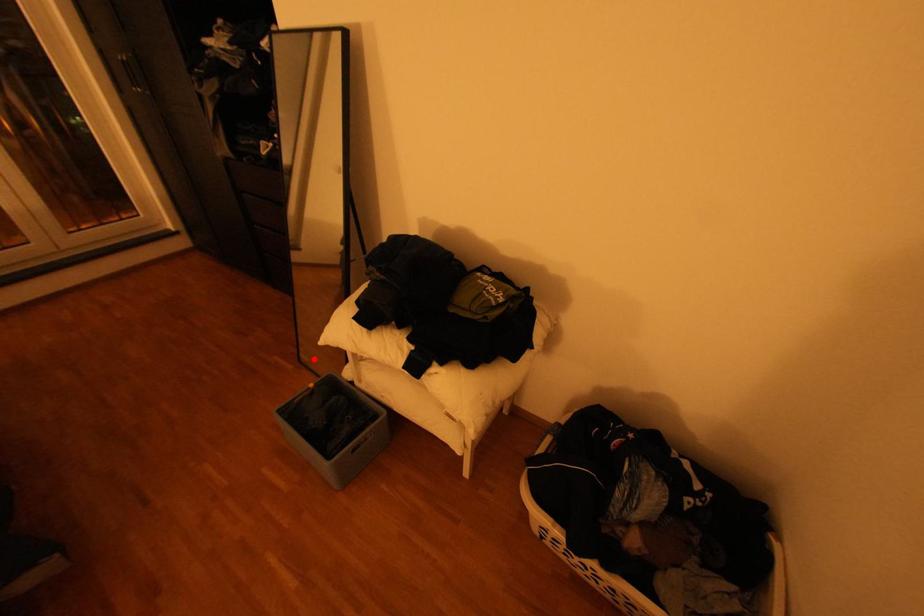
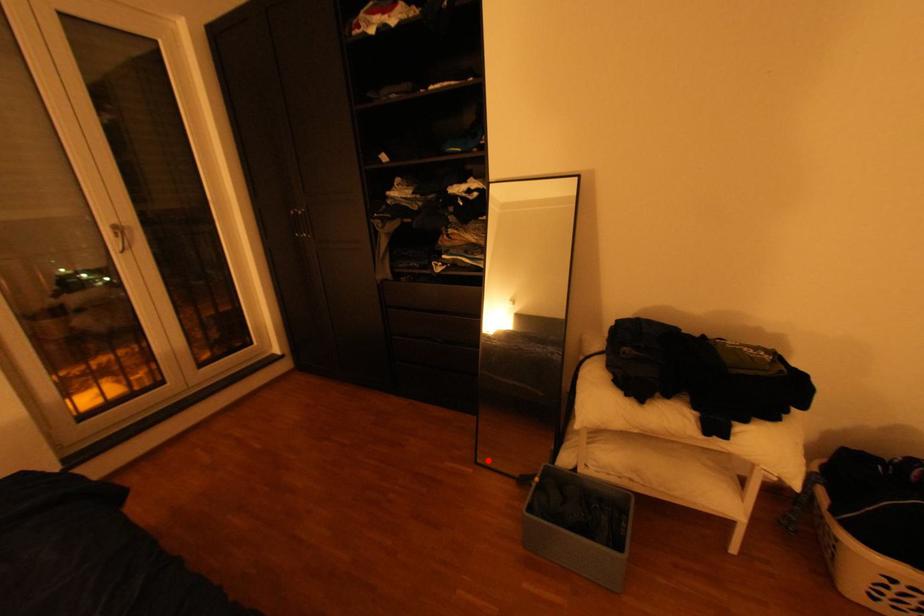
I am providing you with two images of the same scene from different viewpoints. A red point is marked on the first image and another point is marked on the second image. Do the highlighted points in image1 and image2 indicate the same real-world spot?

Yes